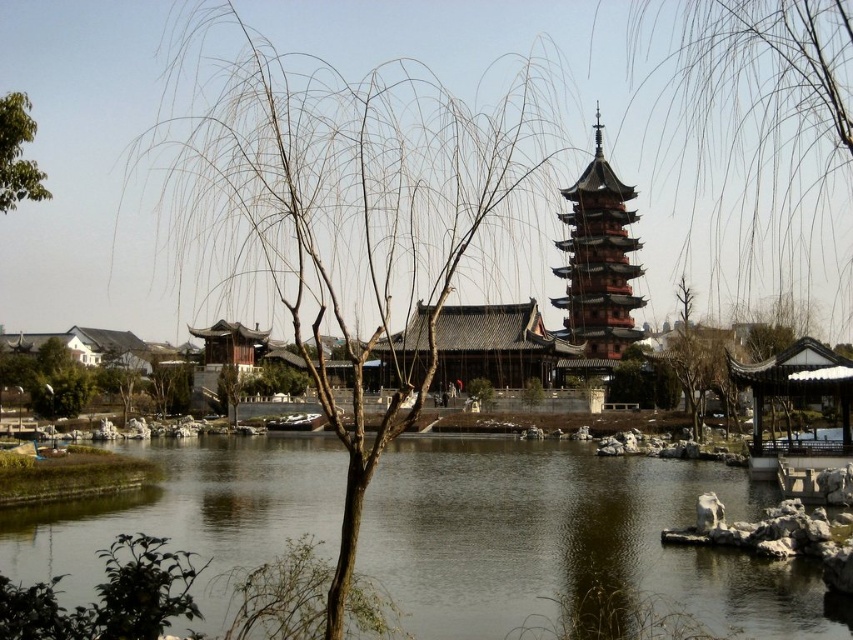
You are standing at the point marked as point [351,212] in the image. What is the surface you are standing on?

You are standing on a bare wood tree at center.

You are standing at the entrance of the temple complex and want to take a photo of the pagoda with the bare wood tree at center in the frame. Based on their positions, will the tree block the view of the pagoda in your photo?

The bare wood tree at center is positioned at point (351, 212), which is in the foreground. Since the pagoda is in the background, the tree might block part of the pagoda in the photo unless you adjust your angle or position to frame them without overlap.

You are a landscape architect designing a pathway between the bare wood tree at center and the bare branches at upper center. Given that the pathway must be exactly 170 feet long, will the pathway fit perfectly between them?

The distance between the bare wood tree at center and the bare branches at upper center is 170.80 feet, so a 170 feet pathway will be slightly shorter than the required distance and won not fit perfectly between them.